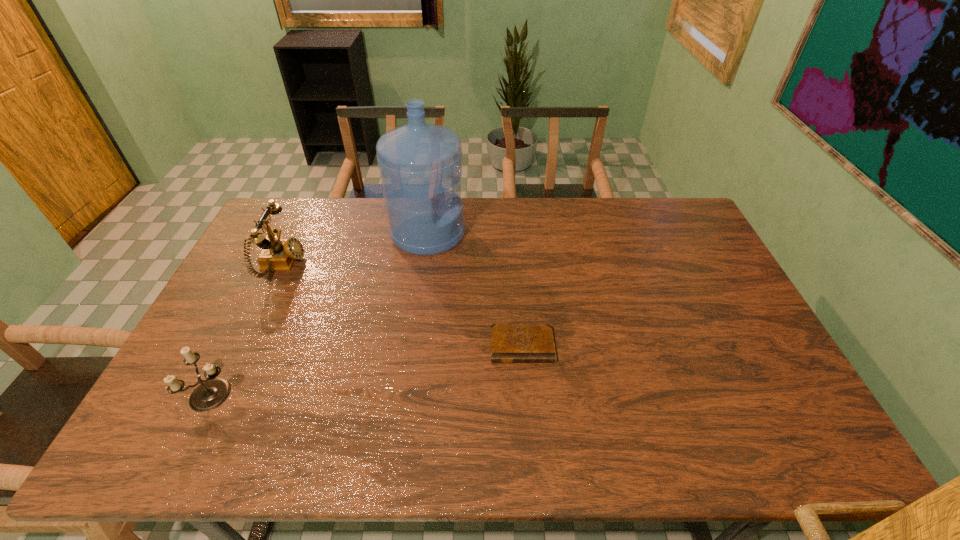
Image resolution: width=960 pixels, height=540 pixels. Identify the location of vacant area between the telephone and the water jug. (355, 249).

Find the location of a particular element. The image size is (960, 540). vacant space in between the third shortest object and the candle holder is located at coordinates (248, 330).

Image resolution: width=960 pixels, height=540 pixels. Find the location of `free space between the telephone and the rightmost object`. free space between the telephone and the rightmost object is located at coordinates (402, 305).

Find the location of `free space between the third object from left to right and the candle holder`. free space between the third object from left to right and the candle holder is located at coordinates (321, 314).

Locate an element on the screen. free space between the diary and the telephone is located at coordinates (402, 305).

Locate an element on the screen. This screenshot has width=960, height=540. vacant area between the candle holder and the second object from right to left is located at coordinates (321, 314).

The width and height of the screenshot is (960, 540). I want to click on vacant space that is in between the third object from left to right and the third tallest object, so click(321, 314).

Locate an element on the screen. The height and width of the screenshot is (540, 960). free space that is in between the tallest object and the candle holder is located at coordinates (321, 314).

Image resolution: width=960 pixels, height=540 pixels. Identify the location of unoccupied area between the diary and the second shortest object. (368, 370).

I want to click on empty space between the nearest object and the tallest object, so (x=321, y=314).